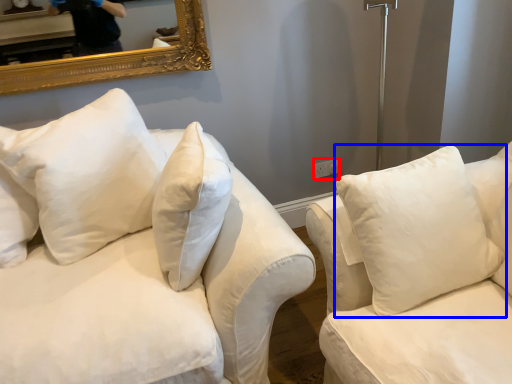
Question: Which of the following is the closest to the observer, electric outlet (highlighted by a red box) or pillow (highlighted by a blue box)?

Choices:
 (A) electric outlet
 (B) pillow

Answer: (B)